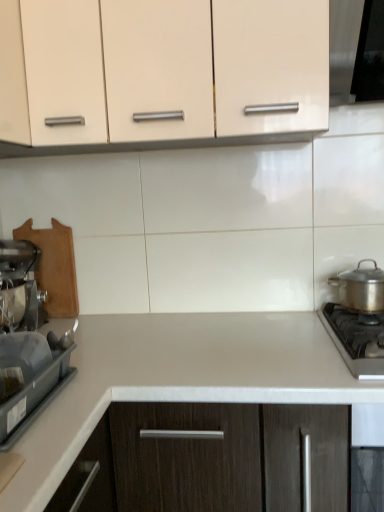
The width and height of the screenshot is (384, 512). What do you see at coordinates (179, 379) in the screenshot?
I see `white laminate countertop at center` at bounding box center [179, 379].

Describe the element at coordinates (361, 287) in the screenshot. I see `satin silver pot at right, the 2th kitchen appliance when ordered from left to right` at that location.

Identify the location of white laminate countertop at center. The height and width of the screenshot is (512, 384). (179, 379).

Consider the image. From the image's perspective, does matte cream cabinet at upper center appear higher than satin silver pot at right, the 1th kitchen appliance positioned from the right?

Yes, from the image's perspective, matte cream cabinet at upper center is over satin silver pot at right, the 1th kitchen appliance positioned from the right.

Can you confirm if matte cream cabinet at upper center is smaller than satin silver pot at right, the 2th kitchen appliance when ordered from left to right?

Actually, matte cream cabinet at upper center might be larger than satin silver pot at right, the 2th kitchen appliance when ordered from left to right.

Between matte cream cabinet at upper center and satin silver pot at right, the 1th kitchen appliance positioned from the right, which one is positioned behind?

satin silver pot at right, the 1th kitchen appliance positioned from the right, is behind.

Is there a large distance between white laminate countertop at center and stainless steel gas stove at lower right?

No, white laminate countertop at center is not far away from stainless steel gas stove at lower right.

Considering the sizes of white laminate countertop at center and stainless steel gas stove at lower right in the image, is white laminate countertop at center bigger or smaller than stainless steel gas stove at lower right?

Considering their sizes, white laminate countertop at center takes up more space than stainless steel gas stove at lower right.

Is white laminate countertop at center taller or shorter than stainless steel gas stove at lower right?

In the image, white laminate countertop at center appears to be taller than stainless steel gas stove at lower right.

Based on the photo, is matte cream cabinet at upper center at the back of white laminate countertop at center?

No, white laminate countertop at center is not facing the opposite direction of matte cream cabinet at upper center.

Looking at the image, does white laminate countertop at center seem bigger or smaller compared to matte cream cabinet at upper center?

Answer: Considering their sizes, white laminate countertop at center takes up more space than matte cream cabinet at upper center.

Is the position of white laminate countertop at center less distant than that of matte cream cabinet at upper center?

Yes, white laminate countertop at center is closer to the viewer.

Is point (266, 335) in front of point (159, 116)?

No, (266, 335) is further to viewer.

Is stainless steel gas stove at lower right positioned beyond the bounds of satin silver pot at right, the 2th kitchen appliance when ordered from left to right?

Yes, stainless steel gas stove at lower right is located beyond the bounds of satin silver pot at right, the 2th kitchen appliance when ordered from left to right.

Is stainless steel gas stove at lower right looking in the opposite direction of satin silver pot at right, the 2th kitchen appliance when ordered from left to right?

No, satin silver pot at right, the 2th kitchen appliance when ordered from left to right, is not at the back of stainless steel gas stove at lower right.

Which is more to the right, stainless steel gas stove at lower right or satin silver pot at right, the 1th kitchen appliance positioned from the right?

Positioned to the right is satin silver pot at right, the 1th kitchen appliance positioned from the right.

From a real-world perspective, is stainless steel gas stove at lower right physically located above or below satin silver pot at right, the 2th kitchen appliance when ordered from left to right?

stainless steel gas stove at lower right is below satin silver pot at right, the 2th kitchen appliance when ordered from left to right.

Looking at this image, from a real-world perspective, is metallic silver mixer at left, arranged as the second kitchen appliance when viewed from the right, positioned under matte cream cabinet at upper center based on gravity?

Indeed, from a real-world perspective, metallic silver mixer at left, arranged as the second kitchen appliance when viewed from the right, is positioned beneath matte cream cabinet at upper center.

Can we say metallic silver mixer at left, the first kitchen appliance when ordered from left to right, lies outside matte cream cabinet at upper center?

That's correct, metallic silver mixer at left, the first kitchen appliance when ordered from left to right, is outside of matte cream cabinet at upper center.

Considering the relative sizes of metallic silver mixer at left, arranged as the second kitchen appliance when viewed from the right, and matte cream cabinet at upper center in the image provided, is metallic silver mixer at left, arranged as the second kitchen appliance when viewed from the right, taller than matte cream cabinet at upper center?

In fact, metallic silver mixer at left, arranged as the second kitchen appliance when viewed from the right, may be shorter than matte cream cabinet at upper center.

Is metallic silver mixer at left, the first kitchen appliance when ordered from left to right, facing away from matte cream cabinet at upper center?

No, matte cream cabinet at upper center is not at the back of metallic silver mixer at left, the first kitchen appliance when ordered from left to right.

This screenshot has height=512, width=384. What are the coordinates of `kitchen appliance located behind the metallic silver mixer at left, the first kitchen appliance when ordered from left to right` in the screenshot? It's located at (361, 287).

Is metallic silver mixer at left, arranged as the second kitchen appliance when viewed from the right, turned away from satin silver pot at right, the 1th kitchen appliance positioned from the right?

metallic silver mixer at left, arranged as the second kitchen appliance when viewed from the right, does not have its back to satin silver pot at right, the 1th kitchen appliance positioned from the right.

From a real-world perspective, which object stands above the other?

From a 3D spatial view, metallic silver mixer at left, the first kitchen appliance when ordered from left to right, is above.

Does metallic silver mixer at left, the first kitchen appliance when ordered from left to right, contain satin silver pot at right, the 1th kitchen appliance positioned from the right?

No, satin silver pot at right, the 1th kitchen appliance positioned from the right, is not a part of metallic silver mixer at left, the first kitchen appliance when ordered from left to right.

Is metallic silver mixer at left, arranged as the second kitchen appliance when viewed from the right, spatially inside white laminate countertop at center, or outside of it?

metallic silver mixer at left, arranged as the second kitchen appliance when viewed from the right, cannot be found inside white laminate countertop at center.

Is there a large distance between metallic silver mixer at left, arranged as the second kitchen appliance when viewed from the right, and white laminate countertop at center?

Actually, metallic silver mixer at left, arranged as the second kitchen appliance when viewed from the right, and white laminate countertop at center are a little close together.

Locate an element on the screen. The height and width of the screenshot is (512, 384). kitchen appliance on the left side of white laminate countertop at center is located at coordinates (18, 285).

Based on the photo, is metallic silver mixer at left, the first kitchen appliance when ordered from left to right, at the left side of white laminate countertop at center?

Correct, you'll find metallic silver mixer at left, the first kitchen appliance when ordered from left to right, to the left of white laminate countertop at center.

From the image's perspective, count 1st kitchen appliances downward from the matte cream cabinet at upper center and point to it. Please provide its 2D coordinates.

[(361, 287)]

Identify the location of gas stove above the white laminate countertop at center (from a real-world perspective). (356, 340).

From the image, which object appears to be farther from matte cream cabinet at upper center, white laminate countertop at center or satin silver pot at right, the 1th kitchen appliance positioned from the right?

satin silver pot at right, the 1th kitchen appliance positioned from the right, lies further to matte cream cabinet at upper center than the other object.

Looking at the image, which one is located further to stainless steel gas stove at lower right, satin silver pot at right, the 2th kitchen appliance when ordered from left to right, or white laminate countertop at center?

The object further to stainless steel gas stove at lower right is white laminate countertop at center.

When comparing their distances from matte cream cabinet at upper center, does satin silver pot at right, the 1th kitchen appliance positioned from the right, or metallic silver mixer at left, arranged as the second kitchen appliance when viewed from the right, seem further?

Based on the image, satin silver pot at right, the 1th kitchen appliance positioned from the right, appears to be further to matte cream cabinet at upper center.

Based on their spatial positions, is metallic silver mixer at left, arranged as the second kitchen appliance when viewed from the right, or satin silver pot at right, the 1th kitchen appliance positioned from the right, further from white laminate countertop at center?

The object further to white laminate countertop at center is satin silver pot at right, the 1th kitchen appliance positioned from the right.

When comparing their distances from metallic silver mixer at left, arranged as the second kitchen appliance when viewed from the right, does stainless steel gas stove at lower right or matte cream cabinet at upper center seem closer?

The object closer to metallic silver mixer at left, arranged as the second kitchen appliance when viewed from the right, is matte cream cabinet at upper center.

Estimate the real-world distances between objects in this image. Which object is further from matte cream cabinet at upper center, metallic silver mixer at left, the first kitchen appliance when ordered from left to right, or white laminate countertop at center?

white laminate countertop at center lies further to matte cream cabinet at upper center than the other object.

Estimate the real-world distances between objects in this image. Which object is further from matte cream cabinet at upper center, stainless steel gas stove at lower right or white laminate countertop at center?

stainless steel gas stove at lower right is further to matte cream cabinet at upper center.

Considering their positions, is white laminate countertop at center positioned closer to stainless steel gas stove at lower right than satin silver pot at right, the 2th kitchen appliance when ordered from left to right?

satin silver pot at right, the 2th kitchen appliance when ordered from left to right, is positioned closer to the anchor stainless steel gas stove at lower right.

I want to click on cabinetry situated between metallic silver mixer at left, the first kitchen appliance when ordered from left to right, and satin silver pot at right, the 2th kitchen appliance when ordered from left to right, from left to right, so click(x=165, y=73).

You are a GUI agent. You are given a task and a screenshot of the screen. Output one action in this format:
    pyautogui.click(x=<x>, y=<y>)
    Task: Click on the gas stove between matte cream cabinet at upper center and white laminate countertop at center in the up-down direction
    
    Given the screenshot: What is the action you would take?
    pyautogui.click(x=356, y=340)

Where is `countertop between metallic silver mixer at left, arranged as the second kitchen appliance when viewed from the right, and satin silver pot at right, the 2th kitchen appliance when ordered from left to right, from left to right`? countertop between metallic silver mixer at left, arranged as the second kitchen appliance when viewed from the right, and satin silver pot at right, the 2th kitchen appliance when ordered from left to right, from left to right is located at coordinates (179, 379).

Locate an element on the screen. Image resolution: width=384 pixels, height=512 pixels. countertop situated between metallic silver mixer at left, arranged as the second kitchen appliance when viewed from the right, and stainless steel gas stove at lower right from left to right is located at coordinates (179, 379).